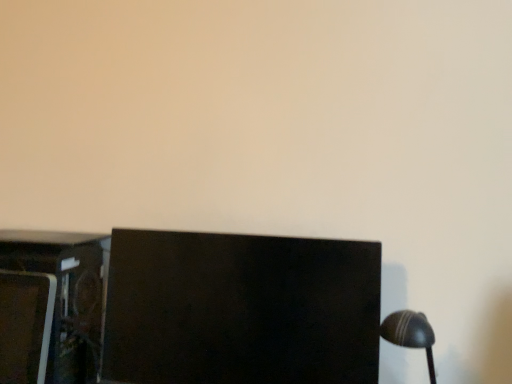
Question: In the image, is metallic dark brown cabinet at lower left on the left side or the right side of black glossy monitor at center?

Choices:
 (A) left
 (B) right

Answer: (A)

Question: From the image's perspective, is metallic dark brown cabinet at lower left positioned above or below black glossy monitor at center?

Choices:
 (A) below
 (B) above

Answer: (A)

Question: Considering the positions of metallic dark brown cabinet at lower left and black glossy monitor at center in the image, is metallic dark brown cabinet at lower left bigger or smaller than black glossy monitor at center?

Choices:
 (A) small
 (B) big

Answer: (A)

Question: In terms of width, does black glossy monitor at center look wider or thinner when compared to metallic dark brown cabinet at lower left?

Choices:
 (A) wide
 (B) thin

Answer: (B)

Question: Based on their positions, is black glossy monitor at center located to the left or right of metallic dark brown cabinet at lower left?

Choices:
 (A) left
 (B) right

Answer: (B)

Question: From the image's perspective, relative to metallic dark brown cabinet at lower left, is black glossy monitor at center above or below?

Choices:
 (A) above
 (B) below

Answer: (A)

Question: From a real-world perspective, is black glossy monitor at center physically located above or below metallic dark brown cabinet at lower left?

Choices:
 (A) above
 (B) below

Answer: (A)